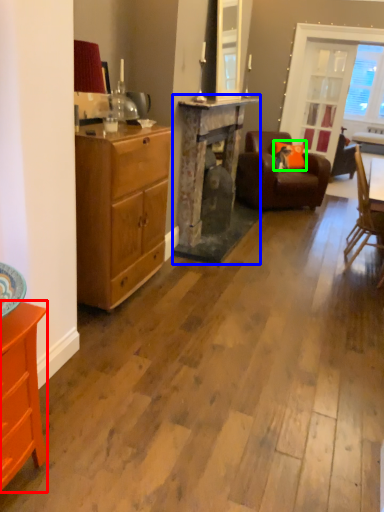
Question: Considering the real-world distances, which object is farthest from cabinetry (highlighted by a red box)? fireplace (highlighted by a blue box) or pillow (highlighted by a green box)?

Choices:
 (A) fireplace
 (B) pillow

Answer: (B)